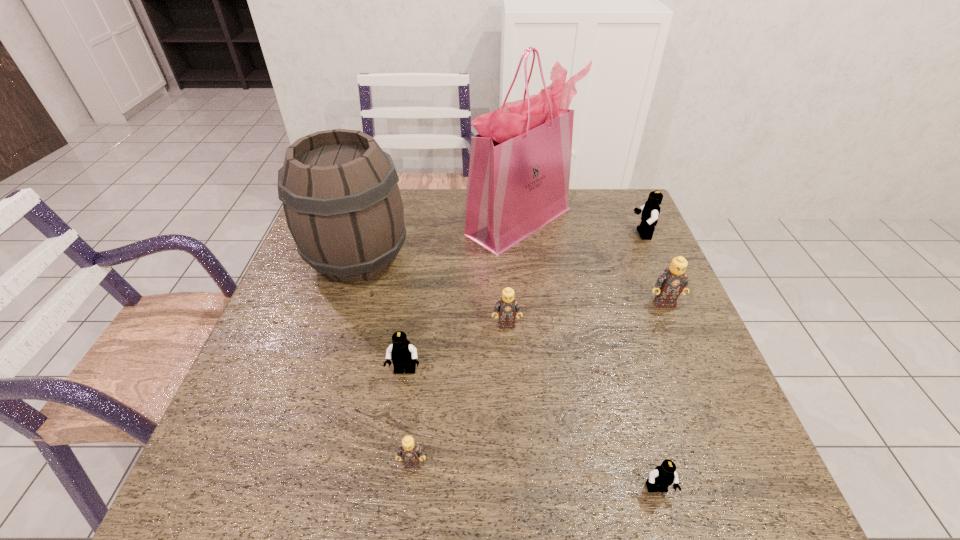
You are a GUI agent. You are given a task and a screenshot of the screen. Output one action in this format:
    pyautogui.click(x=<x>, y=<y>)
    Task: Click on the black Lego that is the closest to the farthest black Lego
    This screenshot has height=540, width=960.
    Given the screenshot: What is the action you would take?
    pyautogui.click(x=663, y=476)

This screenshot has width=960, height=540. I want to click on tan Lego that is the third closest to the second tallest object, so click(673, 281).

Image resolution: width=960 pixels, height=540 pixels. I want to click on tan Lego that is the nearest to the smallest black Lego, so pyautogui.click(x=411, y=453).

The image size is (960, 540). In order to click on free spot that satisfies the following two spatial constraints: 1. on the back side of the tallest object; 2. on the left side of the second tallest object in this screenshot , I will do `click(370, 221)`.